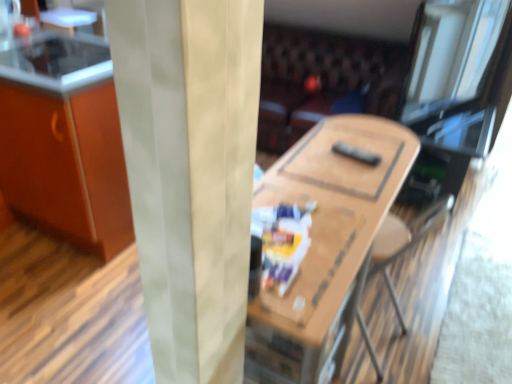
This screenshot has width=512, height=384. What are the coordinates of `wooden table at center` in the screenshot? It's located at (332, 232).

Image resolution: width=512 pixels, height=384 pixels. What do you see at coordinates (56, 61) in the screenshot?
I see `smooth glass counter top at upper left` at bounding box center [56, 61].

The height and width of the screenshot is (384, 512). What do you see at coordinates (323, 81) in the screenshot?
I see `leather couch at center` at bounding box center [323, 81].

Find the location of `orange matte cabinet at left`. orange matte cabinet at left is located at coordinates (64, 139).

Is wooden table at center positioned beyond the bounds of smooth glass counter top at upper left?

That's correct, wooden table at center is outside of smooth glass counter top at upper left.

Which object is further away from the camera, wooden table at center or smooth glass counter top at upper left?

smooth glass counter top at upper left is further from the camera.

Is wooden table at center at the left side of smooth glass counter top at upper left?

In fact, wooden table at center is to the right of smooth glass counter top at upper left.

Is wooden table at center positioned with its back to smooth glass counter top at upper left?

Yes, smooth glass counter top at upper left is at the back of wooden table at center.

Can you confirm if orange matte cabinet at left is wider than leather couch at center?

In fact, orange matte cabinet at left might be narrower than leather couch at center.

Is orange matte cabinet at left positioned far away from leather couch at center?

Yes, orange matte cabinet at left is far from leather couch at center.

Does orange matte cabinet at left have a greater height compared to leather couch at center?

Yes.

Is orange matte cabinet at left positioned with its back to leather couch at center?

Absolutely, orange matte cabinet at left is directed away from leather couch at center.

Between point (391, 78) and point (28, 76), which one is positioned behind?

Point (391, 78)

Between leather couch at center and smooth glass counter top at upper left, which one has less height?

smooth glass counter top at upper left.

Could you tell me if leather couch at center is turned towards smooth glass counter top at upper left?

Yes, leather couch at center faces towards smooth glass counter top at upper left.

From the image's perspective, is leather couch at center above smooth glass counter top at upper left?

Yes.

Is orange matte cabinet at left turned away from smooth glass counter top at upper left?

No, orange matte cabinet at left's orientation is not away from smooth glass counter top at upper left.

Between orange matte cabinet at left and smooth glass counter top at upper left, which one has more height?

Standing taller between the two is orange matte cabinet at left.

Find the location of a particular element. This screenshot has height=384, width=512. cabinetry located on the left of smooth glass counter top at upper left is located at coordinates (64, 139).

Are orange matte cabinet at left and smooth glass counter top at upper left far apart?

No, there isn't a large distance between orange matte cabinet at left and smooth glass counter top at upper left.

From a real-world perspective, which object stands above the other?

smooth glass counter top at upper left, from a real-world perspective.

Is point (45, 80) less distant than point (338, 77)?

That is True.

Considering the sizes of smooth glass counter top at upper left and leather couch at center in the image, is smooth glass counter top at upper left taller or shorter than leather couch at center?

smooth glass counter top at upper left is shorter than leather couch at center.

From the image's perspective, does smooth glass counter top at upper left appear higher than leather couch at center?

No, from the image's perspective, smooth glass counter top at upper left is not on top of leather couch at center.

Considering the relative sizes of leather couch at center and wooden table at center in the image provided, is leather couch at center shorter than wooden table at center?

Correct, leather couch at center is not as tall as wooden table at center.

Locate an element on the screen. This screenshot has width=512, height=384. table below the leather couch at center (from the image's perspective) is located at coordinates (332, 232).

Does leather couch at center have a smaller size compared to wooden table at center?

Incorrect, leather couch at center is not smaller in size than wooden table at center.

Does point (389, 54) come behind point (326, 285)?

Yes, it is.

Does point (328, 193) come in front of point (87, 55)?

Yes.

How much distance is there between wooden table at center and orange matte cabinet at left?

They are 1.12 meters apart.

Which object is thinner, wooden table at center or orange matte cabinet at left?

Thinner between the two is wooden table at center.

From the image's perspective, is wooden table at center located beneath orange matte cabinet at left?

Yes.

Identify the location of counter top above the wooden table at center (from a real-world perspective). This screenshot has height=384, width=512. (56, 61).

Identify the location of couch on the right of orange matte cabinet at left. (323, 81).

When comparing their distances from smooth glass counter top at upper left, does leather couch at center or orange matte cabinet at left seem further?

leather couch at center.

From the image, which object appears to be farther from wooden table at center, smooth glass counter top at upper left or orange matte cabinet at left?

Based on the image, smooth glass counter top at upper left appears to be further to wooden table at center.

Estimate the real-world distances between objects in this image. Which object is further from orange matte cabinet at left, smooth glass counter top at upper left or leather couch at center?

leather couch at center.

Based on their spatial positions, is wooden table at center or leather couch at center further from smooth glass counter top at upper left?

leather couch at center.

Looking at the image, which one is located further to smooth glass counter top at upper left, wooden table at center or orange matte cabinet at left?

wooden table at center is further to smooth glass counter top at upper left.

From the image, which object appears to be farther from wooden table at center, smooth glass counter top at upper left or leather couch at center?

leather couch at center.

When comparing their distances from leather couch at center, does smooth glass counter top at upper left or orange matte cabinet at left seem closer?

orange matte cabinet at left.

When comparing their distances from wooden table at center, does orange matte cabinet at left or smooth glass counter top at upper left seem closer?

Among the two, orange matte cabinet at left is located nearer to wooden table at center.

Find the location of a particular element. The width and height of the screenshot is (512, 384). counter top between wooden table at center and leather couch at center from front to back is located at coordinates (56, 61).

Locate an element on the screen. The height and width of the screenshot is (384, 512). counter top located between orange matte cabinet at left and leather couch at center in the left-right direction is located at coordinates [x=56, y=61].

Locate an element on the screen. This screenshot has width=512, height=384. table situated between orange matte cabinet at left and leather couch at center from left to right is located at coordinates (332, 232).

Locate an element on the screen. This screenshot has width=512, height=384. counter top located between orange matte cabinet at left and wooden table at center in the left-right direction is located at coordinates (56, 61).